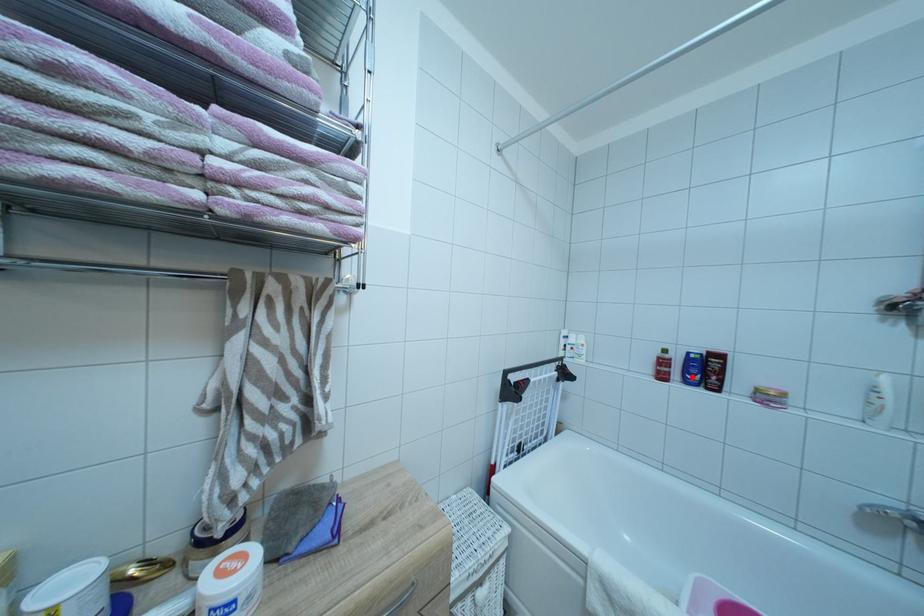
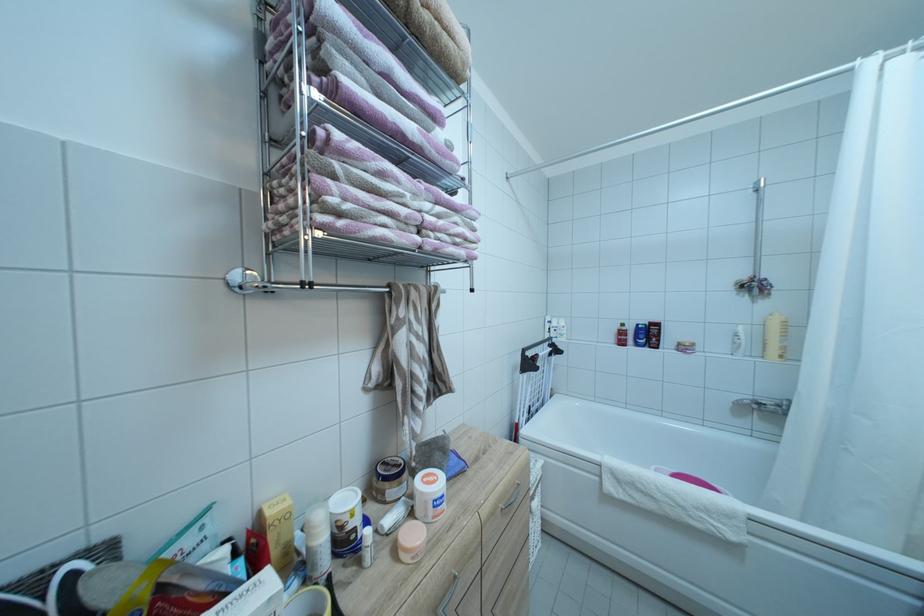
Find the pixel in the second image that matches the highlighted location in the first image.

(642, 342)